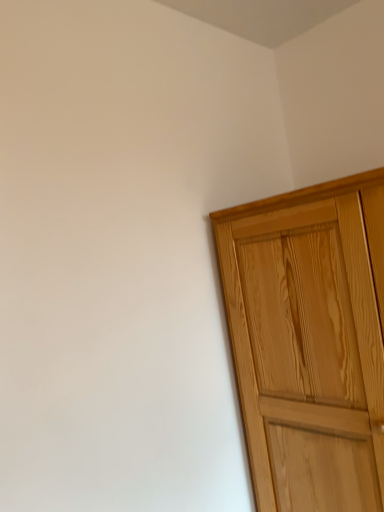
The image size is (384, 512). In order to click on natural wood cupboard at right in this screenshot , I will do [x=309, y=342].

Describe the element at coordinates (309, 342) in the screenshot. I see `natural wood cupboard at right` at that location.

Where is `natural wood cupboard at right`? The height and width of the screenshot is (512, 384). natural wood cupboard at right is located at coordinates (309, 342).